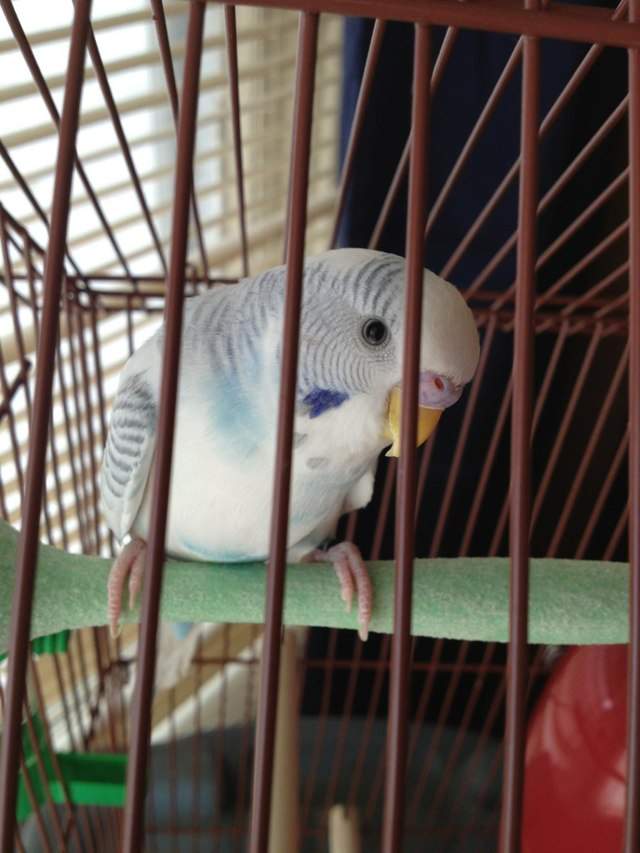
The height and width of the screenshot is (853, 640). Identify the location of wall. (454, 84), (575, 445).